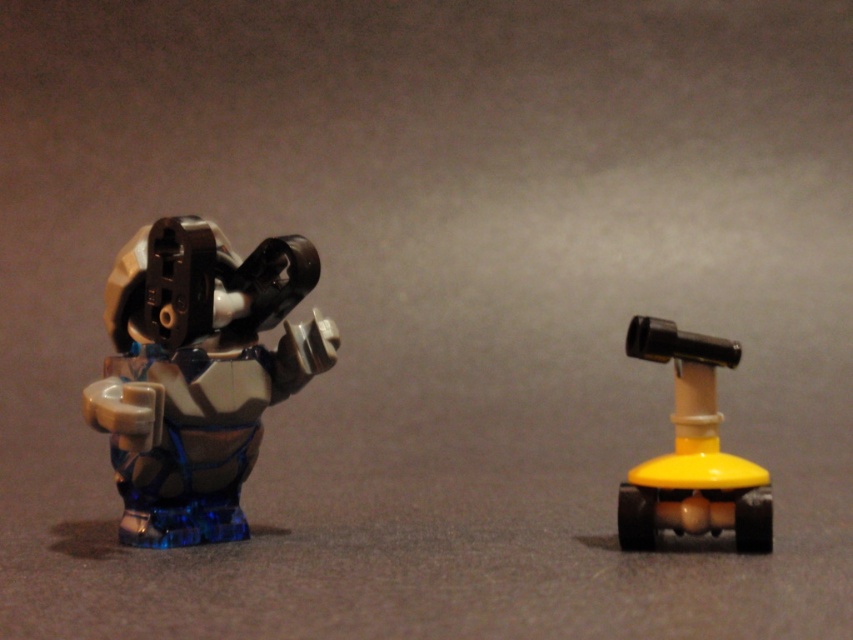
Question: Is translucent blue plastic robot at left to the right of yellow matte telescope at right from the viewer's perspective?

Choices:
 (A) yes
 (B) no

Answer: (B)

Question: Does translucent blue plastic robot at left have a larger size compared to yellow matte telescope at right?

Choices:
 (A) no
 (B) yes

Answer: (B)

Question: Does translucent blue plastic robot at left appear on the right side of yellow matte telescope at right?

Choices:
 (A) no
 (B) yes

Answer: (A)

Question: Among these points, which one is nearest to the camera?

Choices:
 (A) (308, 244)
 (B) (714, 392)

Answer: (B)

Question: Among these points, which one is farthest from the camera?

Choices:
 (A) (648, 531)
 (B) (151, 412)

Answer: (A)

Question: Which point is closer to the camera?

Choices:
 (A) (724, 499)
 (B) (138, 346)

Answer: (A)